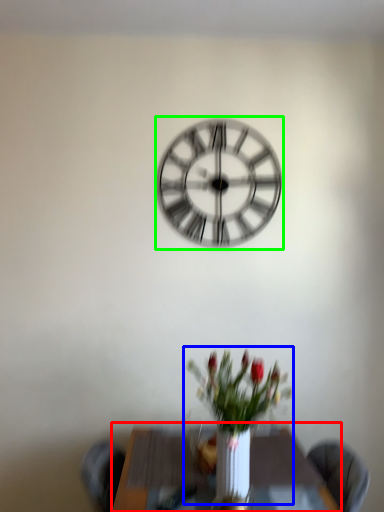
Question: Based on their relative distances, which object is farther from table (highlighted by a red box)? Choose from floral arrangement (highlighted by a blue box) and wall clock (highlighted by a green box).

Choices:
 (A) floral arrangement
 (B) wall clock

Answer: (B)